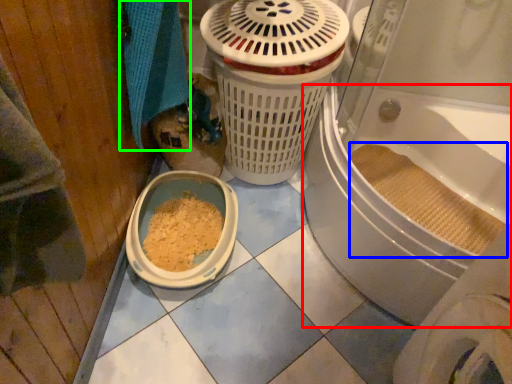
Question: Based on their relative distances, which object is nearer to bath (highlighted by a red box)? Choose from debris (highlighted by a blue box) and bath towel (highlighted by a green box).

Choices:
 (A) debris
 (B) bath towel

Answer: (A)